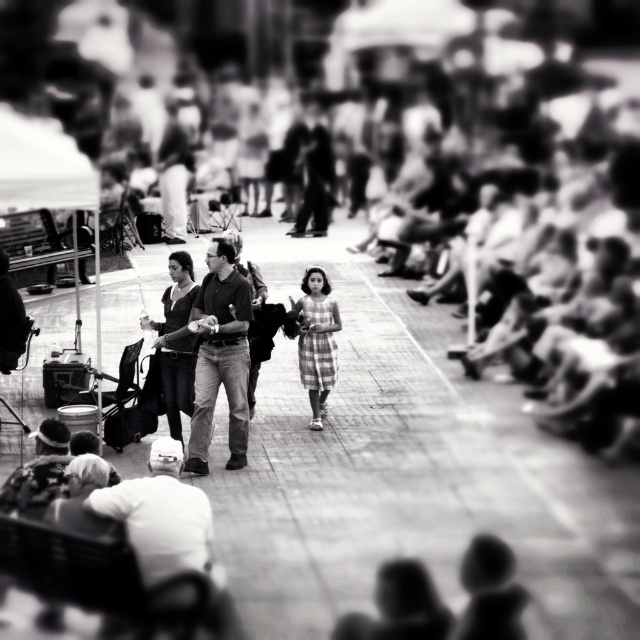
Is smooth gray shirt at lower left below plaid fabric dress at center?

Correct, smooth gray shirt at lower left is located below plaid fabric dress at center.

Is smooth gray shirt at lower left positioned in front of plaid fabric dress at center?

That is True.

Does point (148, 515) lie in front of point (305, 300)?

Yes, it is in front of point (305, 300).

Locate an element on the screen. This screenshot has height=640, width=640. smooth gray shirt at lower left is located at coordinates (163, 516).

What do you see at coordinates (220, 356) in the screenshot? I see `dark gray jeans at center` at bounding box center [220, 356].

Looking at this image, between dark gray jeans at center and camouflage hat at lower left, which one is positioned lower?

camouflage hat at lower left

You are a GUI agent. You are given a task and a screenshot of the screen. Output one action in this format:
    pyautogui.click(x=<x>, y=<y>)
    Task: Click on the dark gray jeans at center
    This screenshot has height=640, width=640.
    Given the screenshot: What is the action you would take?
    pyautogui.click(x=220, y=356)

Is dark gray jeans at center thinner than plaid fabric dress at center?

In fact, dark gray jeans at center might be wider than plaid fabric dress at center.

Between dark gray jeans at center and plaid fabric dress at center, which one is positioned lower?

dark gray jeans at center is lower down.

What do you see at coordinates (220, 356) in the screenshot? I see `dark gray jeans at center` at bounding box center [220, 356].

Identify the location of dark gray jeans at center. The image size is (640, 640). pos(220,356).